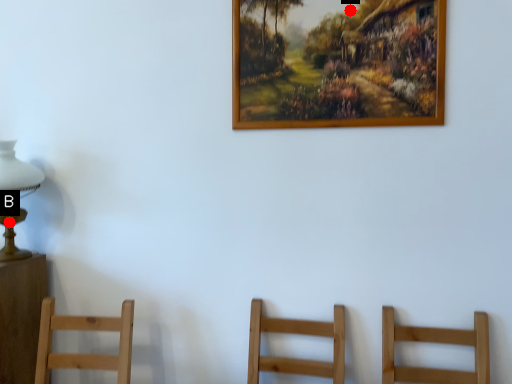
Question: Two points are circled on the image, labeled by A and B beside each circle. Which point appears farthest from the camera in this image?

Choices:
 (A) A is further
 (B) B is further

Answer: (B)